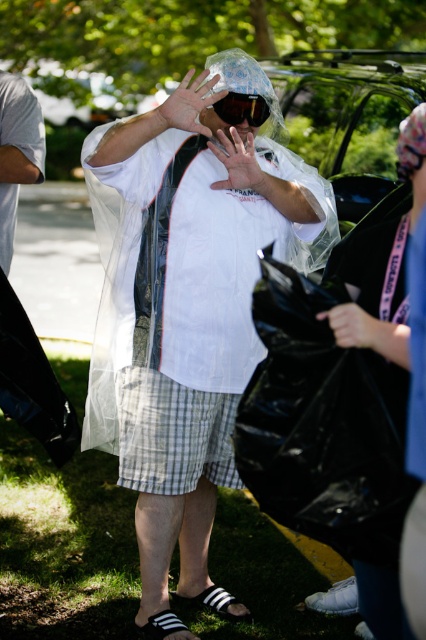
Consider the image. You are trying to figure out if the transparent plastic poncho at center can completely cover the smooth skin hand at center. Based on their sizes, what do you think?

The transparent plastic poncho at center is wider than the smooth skin hand at center, so it can completely cover the smooth skin hand at center.